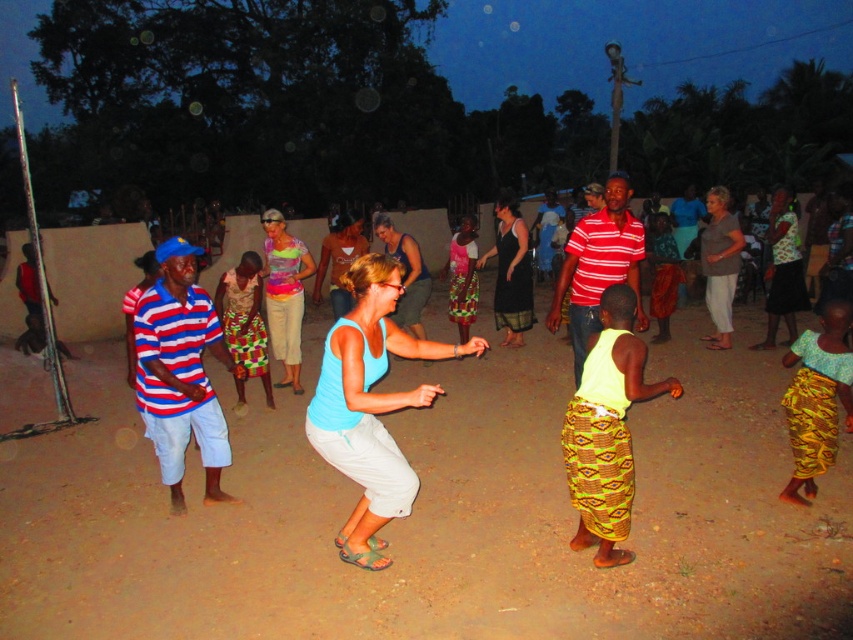
In the scene shown: Measure the distance between blue fabric tank top at center and striped cotton shirt at center.

blue fabric tank top at center is 1.73 meters from striped cotton shirt at center.

Is point (346, 390) positioned after point (573, 376)?

No, (346, 390) is closer to viewer.

This screenshot has height=640, width=853. Identify the location of blue fabric tank top at center. (370, 404).

Between blue fabric tank top at center and multicolored fabric dress at center, which one has less height?

With less height is blue fabric tank top at center.

Can you confirm if blue fabric tank top at center is positioned to the right of multicolored fabric dress at center?

Correct, you'll find blue fabric tank top at center to the right of multicolored fabric dress at center.

What do you see at coordinates (370, 404) in the screenshot? I see `blue fabric tank top at center` at bounding box center [370, 404].

You are a GUI agent. You are given a task and a screenshot of the screen. Output one action in this format:
    pyautogui.click(x=<x>, y=<y>)
    Task: Click on the blue fabric tank top at center
    
    Given the screenshot: What is the action you would take?
    pyautogui.click(x=370, y=404)

Between yellow printed skirt at center and multicolored fabric dress at center, which one appears on the left side from the viewer's perspective?

From the viewer's perspective, multicolored fabric dress at center appears more on the left side.

Between point (563, 442) and point (283, 316), which one is positioned in front?

Point (563, 442)

What are the coordinates of `yellow printed skirt at center` in the screenshot? It's located at [607, 429].